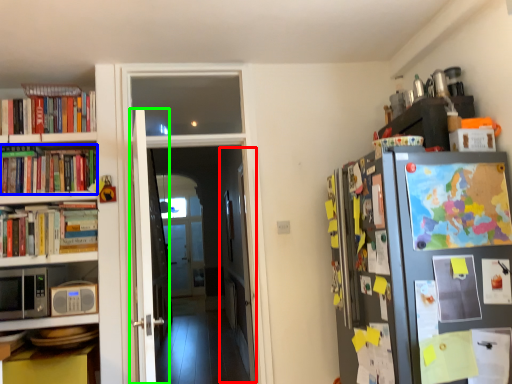
Question: Which object is the farthest from door (highlighted by a red box)? Choose among these: book (highlighted by a blue box) or door (highlighted by a green box).

Choices:
 (A) book
 (B) door

Answer: (B)